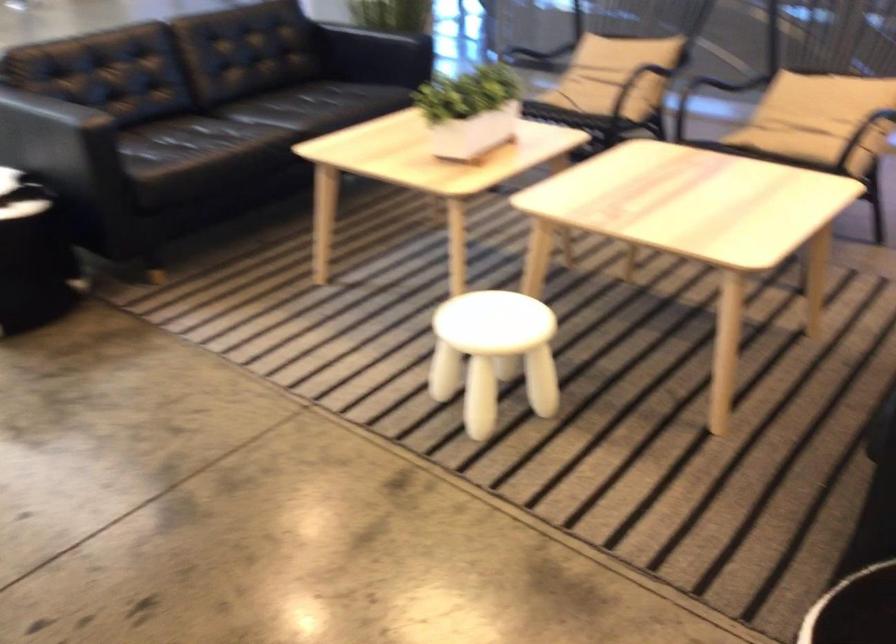
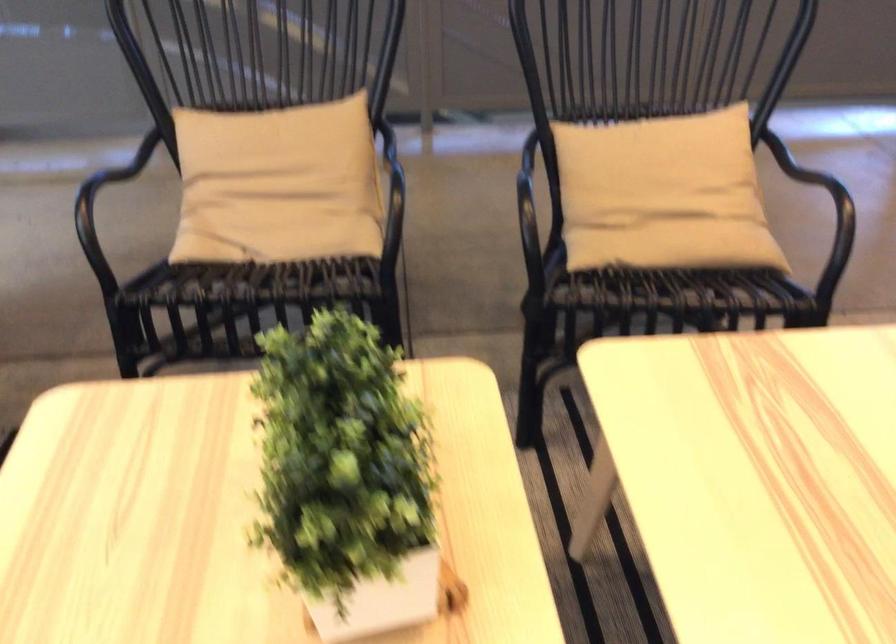
Question: I am providing you with two images of the same scene from different viewpoints. Which of the following objects are not visible in image2?

Choices:
 (A) black chair sitting surface
 (B) small potted plant
 (C) chair armrest
 (D) yellow shower sponge

Answer: (C)